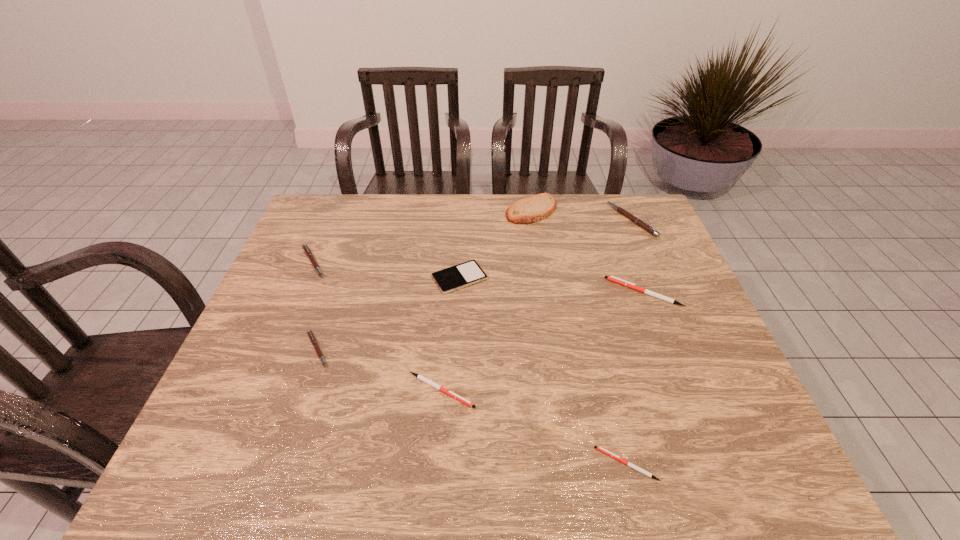
I want to click on the leftmost white pen, so click(420, 377).

Where is `the second nearest pen`? the second nearest pen is located at coordinates (420, 377).

Identify the location of the smallest white pen. (601, 449).

This screenshot has height=540, width=960. What are the coordinates of `the nearest object` in the screenshot? It's located at (601, 449).

Find the location of a particular element. The width and height of the screenshot is (960, 540). free space located 0.330m on the front of the pita bread is located at coordinates pyautogui.click(x=544, y=296).

Find the location of a particular element. blank space located at the nib of the biggest pink pen is located at coordinates (588, 220).

This screenshot has width=960, height=540. I want to click on free space located at the nib of the biggest pink pen, so click(492, 220).

Find the location of `free point located at the nib of the biggest pink pen`. free point located at the nib of the biggest pink pen is located at coordinates (552, 220).

Locate an element on the screen. The width and height of the screenshot is (960, 540). free spot located 0.390m at the nib of the leftmost object is located at coordinates (461, 262).

Find the location of a particular element. This screenshot has width=960, height=540. vacant space situated 0.300m on the clicker of the rightmost white pen is located at coordinates (500, 292).